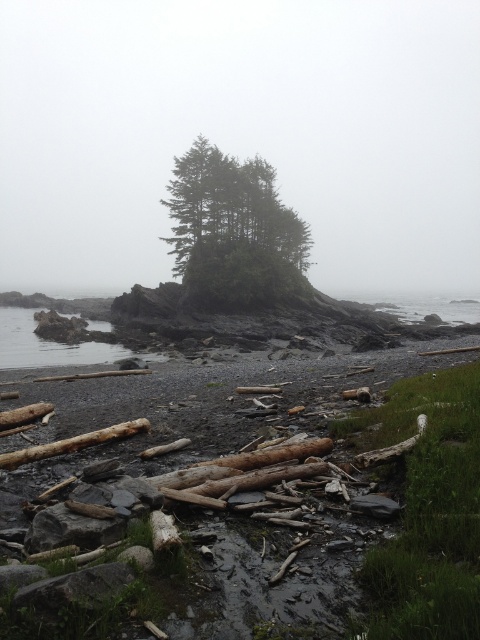
You are standing on the rocky shoreline and want to reach the small island in the middle ground. You see the green matte tree at center and the brown rough log at lower left. Which object is closer to your current position?

The brown rough log at lower left is closer to your current position because it is behind the green matte tree at center, meaning it is nearer to the shoreline where you are standing.

You are standing on the rocky shoreline in the coastal scene. You see a point marked at coordinates (x=233, y=232). What object is located at that point?

The point at coordinates (x=233, y=232) indicates a green matte tree at center.

You are standing on the rocky shoreline and want to reach the brown rough log at lower left without getting your shoes wet. Since the clear water at lower left is between you and the log, can you step over it?

The clear water at lower left is further to the viewer than the brown rough log at lower left, so the log is closer to you. This means the water is behind the log, so you can reach the log without stepping into the water.